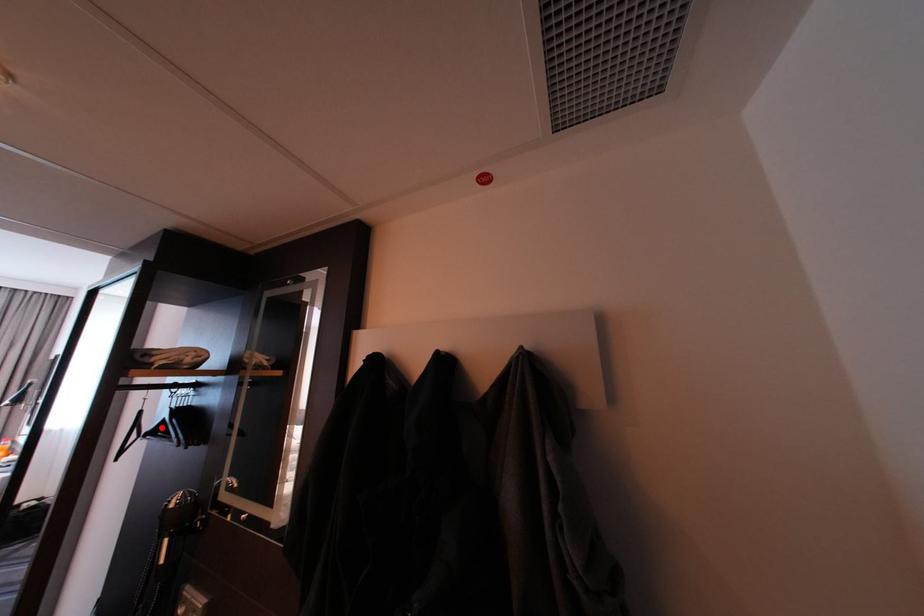
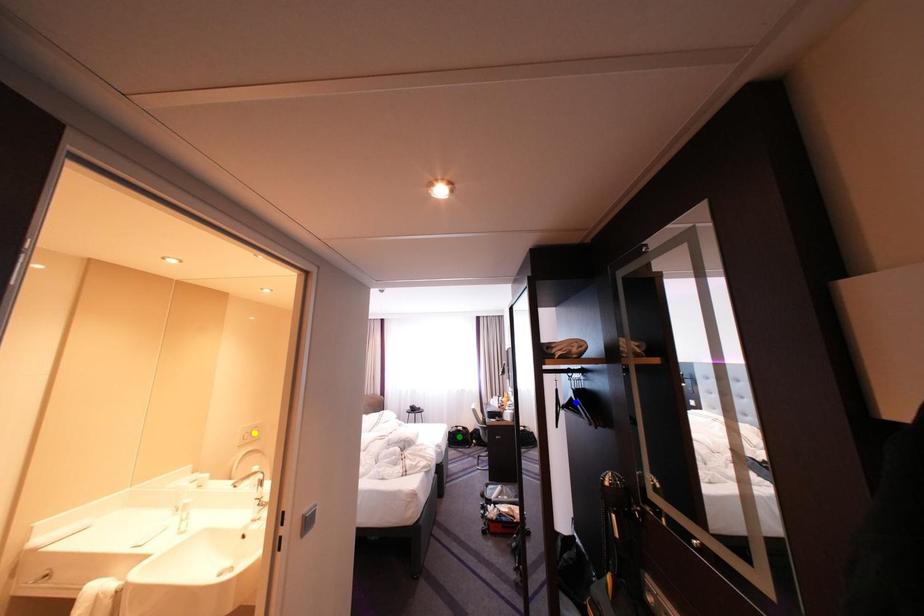
Question: I am providing you with two images of the same scene from different viewpoints. A red point is marked on the first image. You are given multiple points on the second image. In image 2, which mark is for the same physical point as the one in image 1?

Choices:
 (A) blue point
 (B) yellow point
 (C) green point

Answer: (A)